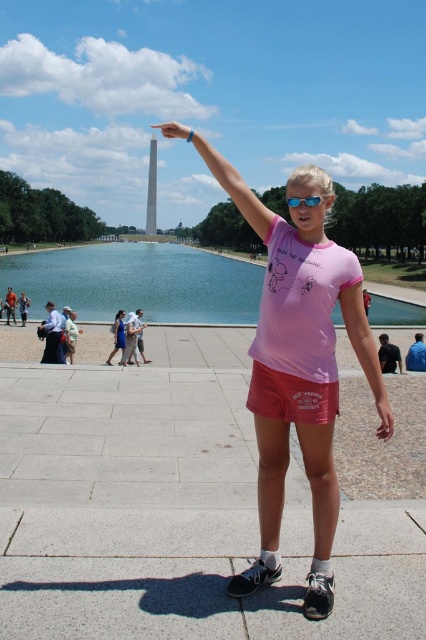
You are standing on the paved walkway and want to take a photo of the tall obelisk monument. To avoid reflections from the clear water at center, where should you position yourself?

The clear water at center is located at point (138, 282), so you should position yourself away from that area to avoid reflections.

You are a park visitor who wants to throw a small pebble into the clear water at center from the pink cotton shorts at center. Can you do it without walking any further than 50 meters?

The clear water at center is 54.07 meters from pink cotton shorts at center, so you cannot throw the pebble into the clear water at center without walking further than 50 meters.

You are standing at the reflecting pool in the midground of the park scene. You notice two points marked in the image, point (215, 176) and point (391, 432). Which point is closer to your eyes?

Point (215, 176) is further to the camera than point (391, 432), so the closer point to your eyes is point (391, 432).